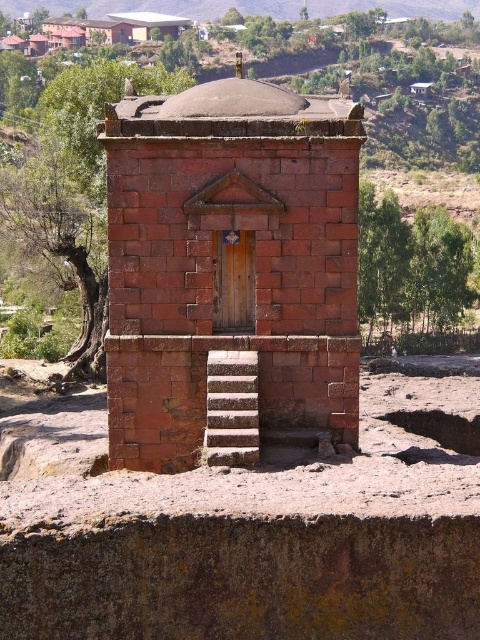
You are an architect designing a new garden layout around the red brick chapel at center and the red brick wall at upper center. Since you need to know the width of these structures to plan the pathways, can you determine which one is narrower?

The red brick chapel at center is thinner than the red brick wall at upper center, so the chapel is narrower than the wall.

You are standing in front of the stone structure and want to enter through the entrance. Which object should you approach first, the red brick wall at upper center or the white stone stairs at center?

You should approach the white stone stairs at center first because the red brick wall at upper center is positioned to the left of the stairs, meaning the stairs are in front of the wall from your perspective.